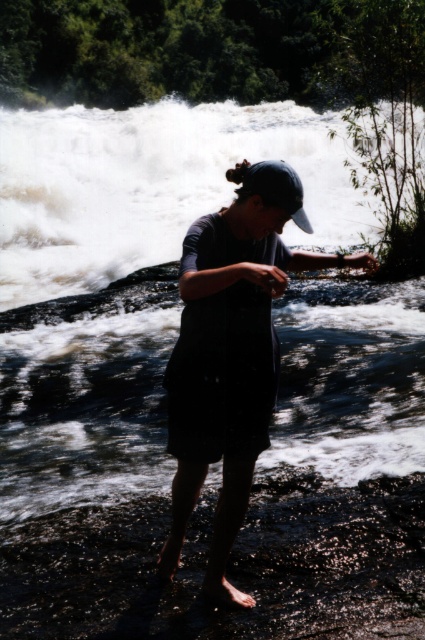
You are standing at point (x=295, y=209) and want to walk to the waterfall. Is the point (x=198, y=481) behind you or in front of you?

Point (x=198, y=481) is behind point (x=295, y=209), so it is behind you.